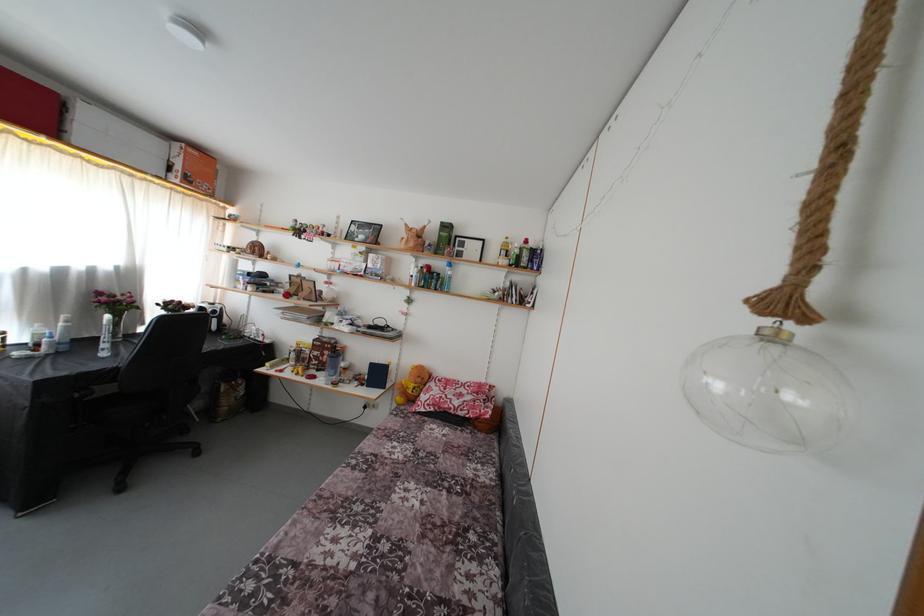
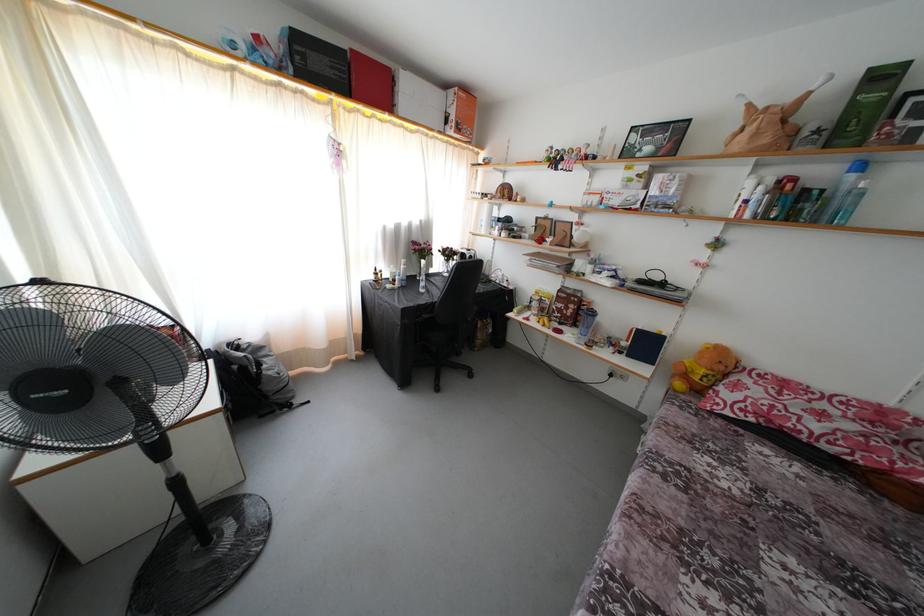
Locate, in the second image, the point that corresponds to [441,392] in the first image.

(760, 389)